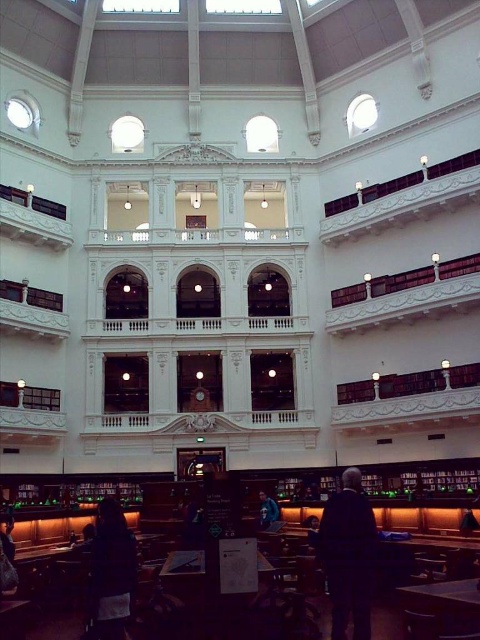
In the scene shown: You are standing in the grand library described. You need to locate the dark suit at lower center. According to the coordinates provided, where would you find it?

The dark suit at lower center is located at the coordinates point (348, 556).

You are a visitor in the library and want to pick up the dark blue fabric jacket at center. To do so, you need to walk around the wooden table at lower right. Is the jacket behind or in front of the table?

The wooden table at lower right is in front of the dark blue fabric jacket at center, so the jacket is behind the table.

You are a visitor in this library and you see two jackets hanging on the wall. The dark fabric jacket at lower left and the dark blue fabric jacket at center. Which jacket is positioned higher up on the wall?

The dark fabric jacket at lower left is positioned higher up on the wall than the dark blue fabric jacket at center.